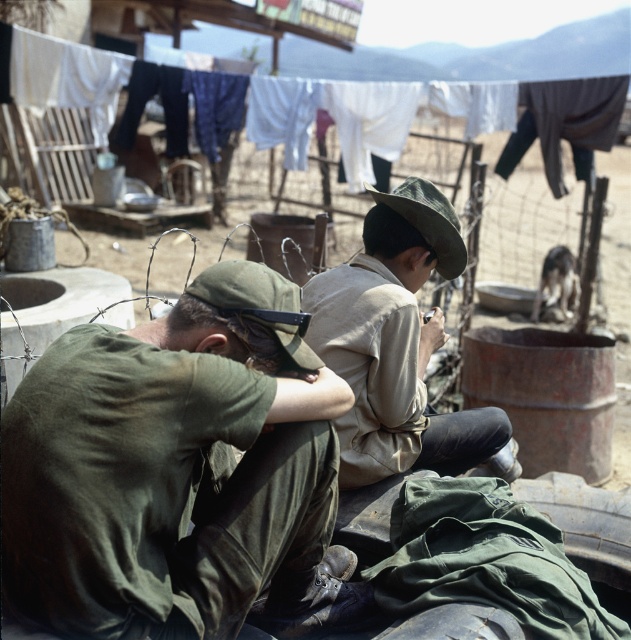
You are a photographer wanting to capture a closeup of the green matte uniform at center and the white cotton clothes at upper center. Since the camera can only focus on one object at a time, which object should you focus on first to ensure the other is still in the frame?

The green matte uniform at center is positioned on the left side of white cotton clothes at upper center, so focusing on the green matte uniform at center first will keep the white cotton clothes at upper center in the frame as they are to the right.

You are a photographer trying to capture a photo of the khaki fabric hat at center and the white cotton clothes at upper center in the scene. Given that your camera has a minimum focus distance of 15 meters, will you be able to focus on both objects simultaneously?

The distance between the khaki fabric hat at center and the white cotton clothes at upper center is 16.71 meters. Since the minimum focus distance of your camera is 15 meters, you will be able to focus on both objects simultaneously because the distance between them is greater than the minimum required focus distance.

You are a photographer trying to capture a closeup of the green matte uniform at center. The camera you are using has a focal length of 50mm and you are currently positioned at point A. To focus on the green matte uniform at center, should you move closer to or farther away from the point at (172, 467)?

The green matte uniform at center is located at point (172, 467). To focus on it with a 50mm lens, you should position the camera so that the focal plane aligns with that point. If point A is not already at that coordinate, adjust your position accordingly.